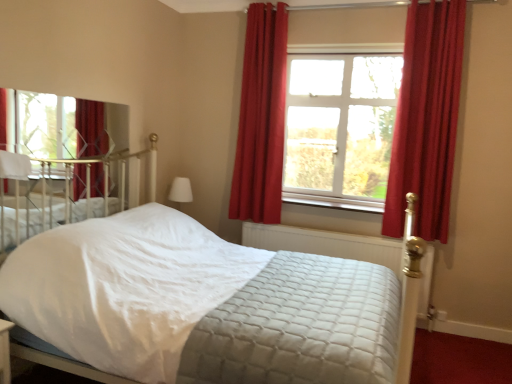
Question: Considering the positions of clear glass mirror at upper left, which is counted as the 2th window, starting from the right, and velvet red curtain at upper right, arranged as the 1th curtain when viewed from the left, in the image, is clear glass mirror at upper left, which is counted as the 2th window, starting from the right, bigger or smaller than velvet red curtain at upper right, arranged as the 1th curtain when viewed from the left,?

Choices:
 (A) small
 (B) big

Answer: (A)

Question: From a real-world perspective, is clear glass mirror at upper left, the 2th window viewed from the back, above or below velvet red curtain at upper right, acting as the 2th curtain starting from the front?

Choices:
 (A) below
 (B) above

Answer: (A)

Question: Estimate the real-world distances between objects in this image. Which object is farther from the quilted fabric mattress at center?

Choices:
 (A) velvet red curtain at upper right, which is the second curtain in right-to-left order
 (B) red velvet curtain at right, positioned as the 1th curtain in front-to-back order
 (C) white soft pillow at upper left
 (D) clear glass window at center, which is the 2th window from left to right
 (E) wooden at center

Answer: (C)

Question: Estimate the real-world distances between objects in this image. Which object is farther from the red velvet curtain at right, which is the first curtain from right to left?

Choices:
 (A) clear glass mirror at upper left, which is counted as the 2th window, starting from the right
 (B) clear glass window at center, the 1th window from the right
 (C) white soft pillow at upper left
 (D) white quilted fabric bed at center
 (E) velvet red curtain at upper right, which is the second curtain in right-to-left order

Answer: (C)